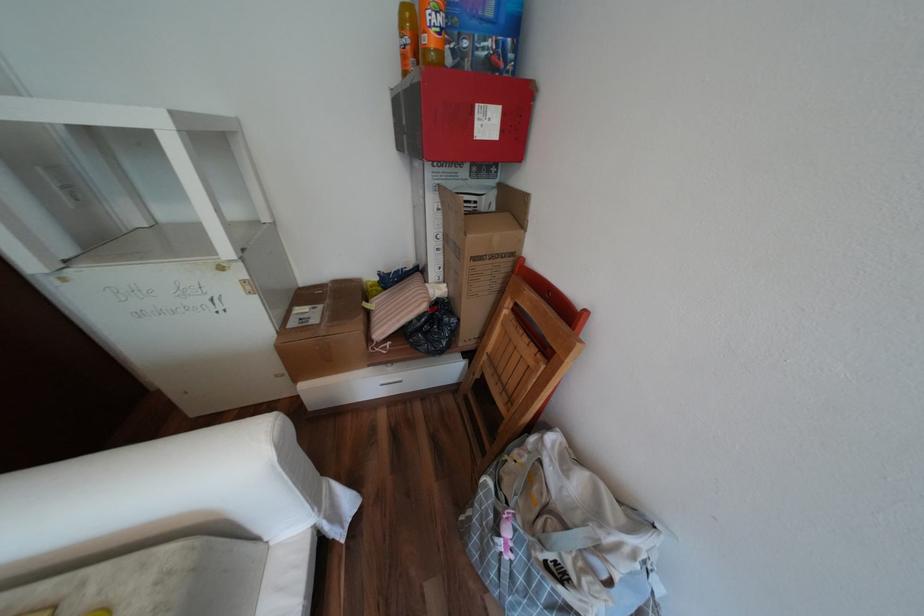
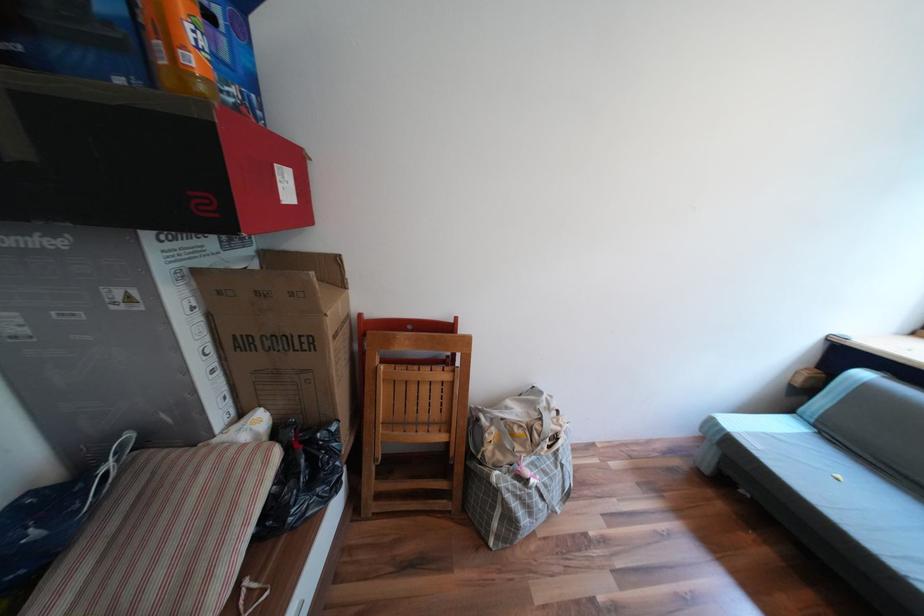
Where in the second image is the point corresponding to pixel 450 237 from the first image?

(219, 349)